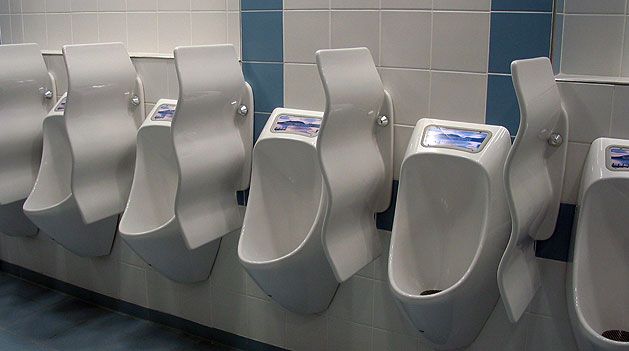
The width and height of the screenshot is (629, 351). Find the location of `urinals`. urinals is located at coordinates (14, 222), (60, 221), (160, 242), (269, 272), (415, 300), (577, 306).